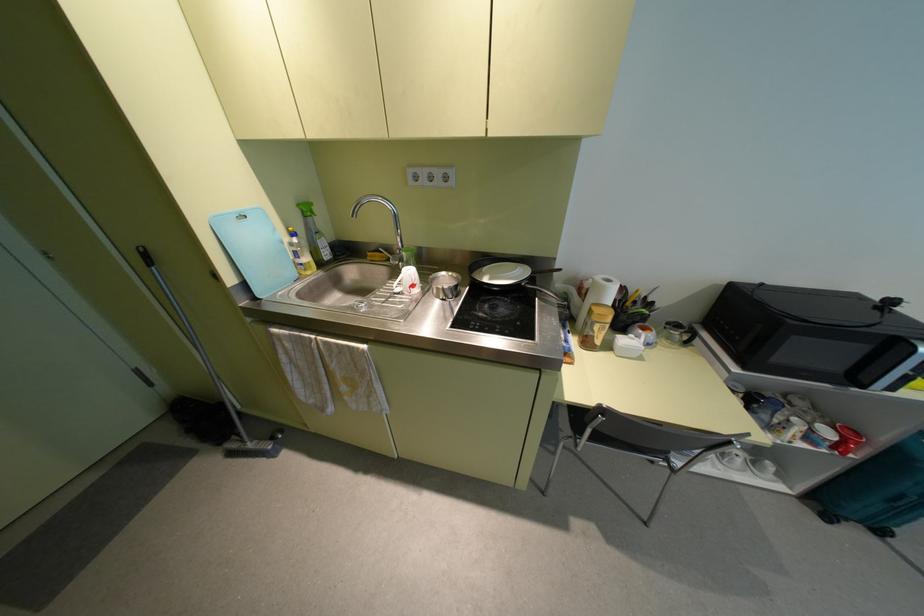
The height and width of the screenshot is (616, 924). What do you see at coordinates (594, 326) in the screenshot?
I see `the gold lid jar` at bounding box center [594, 326].